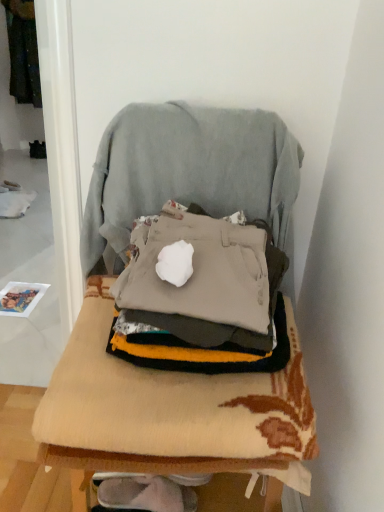
Question: Is point (170, 394) closer or farther from the camera than point (165, 141)?

Choices:
 (A) farther
 (B) closer

Answer: (B)

Question: From a real-world perspective, is beige knitted blanket at center positioned above or below light gray fabric swivel chair at center?

Choices:
 (A) below
 (B) above

Answer: (A)

Question: Based on their relative distances, which object is farther from the beige knitted blanket at center?

Choices:
 (A) beige fabric chair at center
 (B) dark green fabric at upper left
 (C) light gray fabric swivel chair at center

Answer: (B)

Question: Which of these objects is positioned farthest from the light gray fabric swivel chair at center?

Choices:
 (A) beige knitted blanket at center
 (B) beige fabric chair at center
 (C) dark green fabric at upper left

Answer: (C)